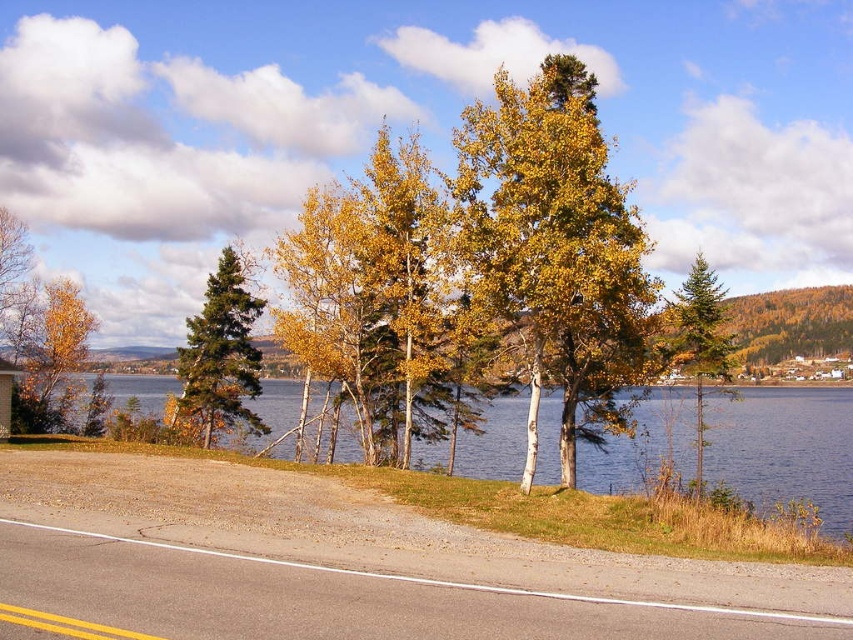
Question: Among these points, which one is nearest to the camera?

Choices:
 (A) (583, 124)
 (B) (228, 324)
 (C) (67, 396)

Answer: (A)

Question: Does yellow-green leaves at center have a lesser width compared to golden yellow leaves at left?

Choices:
 (A) no
 (B) yes

Answer: (A)

Question: Is blue water at center to the left of golden yellow leaves at left from the viewer's perspective?

Choices:
 (A) no
 (B) yes

Answer: (A)

Question: Among these points, which one is farthest from the camera?

Choices:
 (A) (700, 262)
 (B) (834, 422)

Answer: (B)

Question: Which object is positioned farthest from the blue water at center?

Choices:
 (A) green matte evergreen tree at right
 (B) yellow-green leaves at center
 (C) golden yellow leaves at left

Answer: (A)

Question: Is green glossy pine tree at left above green matte evergreen tree at right?

Choices:
 (A) yes
 (B) no

Answer: (B)